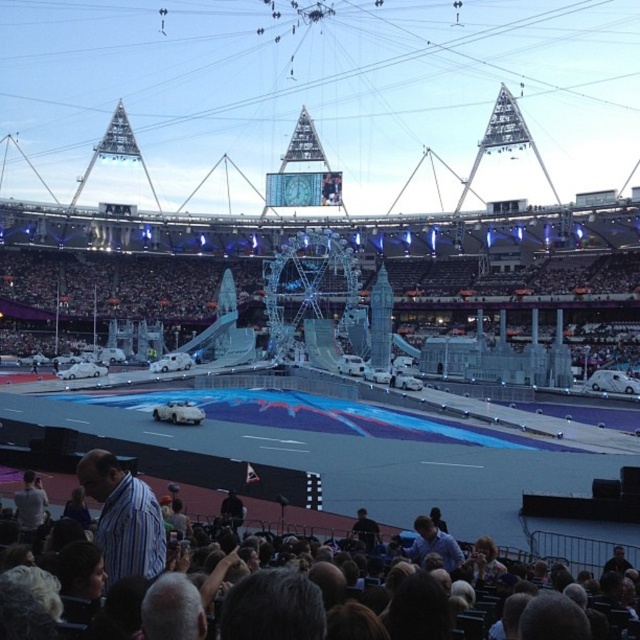
Question: Can you confirm if dark hair at lower center is positioned above striped cotton shirt at lower left?

Choices:
 (A) yes
 (B) no

Answer: (B)

Question: Is dark hair at lower center smaller than striped cotton shirt at lower left?

Choices:
 (A) yes
 (B) no

Answer: (B)

Question: Among these objects, which one is farthest from the camera?

Choices:
 (A) dark hair at lower center
 (B) striped cotton shirt at lower left

Answer: (B)

Question: Does dark hair at lower center have a larger size compared to striped cotton shirt at lower left?

Choices:
 (A) no
 (B) yes

Answer: (B)

Question: Which of the following is the farthest from the observer?

Choices:
 (A) striped cotton shirt at lower left
 (B) dark hair at lower center

Answer: (A)